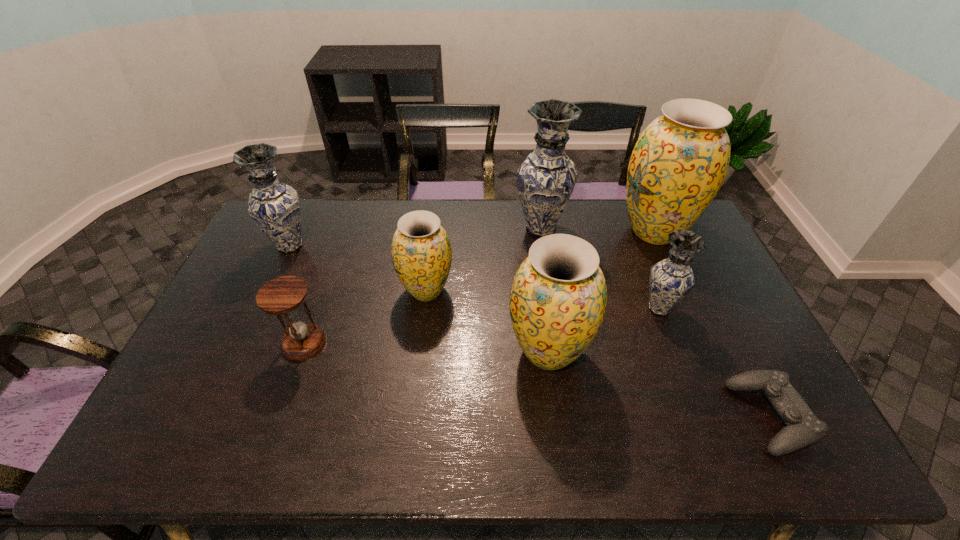
Locate an element on the screen. This screenshot has height=540, width=960. free space at the far edge is located at coordinates (519, 212).

Find the location of a particular element. This screenshot has width=960, height=540. free space at the near edge of the desktop is located at coordinates (550, 427).

Image resolution: width=960 pixels, height=540 pixels. In the image, there is a desktop. Find the location of `free space at the left edge`. free space at the left edge is located at coordinates (240, 300).

This screenshot has width=960, height=540. Identify the location of vacant space at the right edge. (716, 312).

Where is `vacant space at the near right corner of the desktop`? This screenshot has width=960, height=540. vacant space at the near right corner of the desktop is located at coordinates (807, 451).

Locate an element on the screen. This screenshot has width=960, height=540. free spot between the second vase from left to right and the leftmost blue vase is located at coordinates (358, 268).

In order to click on free space that is in between the shortest object and the second blue vase from right to left in this screenshot , I will do `click(656, 323)`.

Where is `unoccupied position between the seventh tallest object and the rightmost yellow vase`? This screenshot has width=960, height=540. unoccupied position between the seventh tallest object and the rightmost yellow vase is located at coordinates (479, 287).

Where is `free spot between the smallest blue vase and the gray control`? free spot between the smallest blue vase and the gray control is located at coordinates (714, 362).

Image resolution: width=960 pixels, height=540 pixels. In order to click on vacant space that is in between the fifth vase from right to left and the leftmost vase in this screenshot , I will do 358,268.